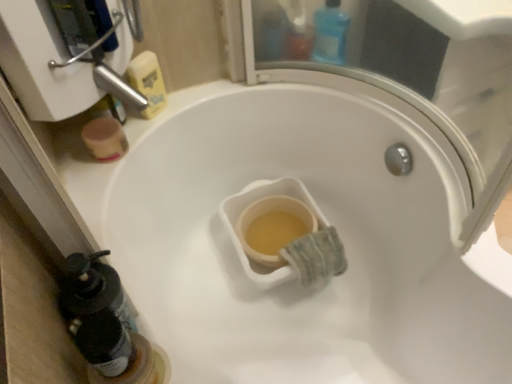
Find the location of a particular element. This screenshot has height=384, width=512. translucent plastic bottle at lower left, the 2th bottle viewed from the back is located at coordinates (x=97, y=313).

Based on the photo, from the image's perspective, which one is positioned lower, blue plastic bottle at upper center, the 1th bottle when ordered from top to bottom, or translucent plastic bottle at lower left, acting as the first bottle starting from the front?

translucent plastic bottle at lower left, acting as the first bottle starting from the front, from the image's perspective.

Locate an element on the screen. bottle on the left of blue plastic bottle at upper center, the 1th bottle when ordered from top to bottom is located at coordinates (97, 313).

How far apart are blue plastic bottle at upper center, positioned as the second bottle in left-to-right order, and translucent plastic bottle at lower left, which is the second bottle in right-to-left order?

blue plastic bottle at upper center, positioned as the second bottle in left-to-right order, is 32.36 inches away from translucent plastic bottle at lower left, which is the second bottle in right-to-left order.

From a real-world perspective, is blue plastic bottle at upper center, the 1th bottle when ordered from top to bottom, positioned above or below translucent plastic bottle at lower left, which is the second bottle in right-to-left order?

blue plastic bottle at upper center, the 1th bottle when ordered from top to bottom, is situated lower than translucent plastic bottle at lower left, which is the second bottle in right-to-left order, in the real world.

Is translucent plastic bottle at lower left, acting as the first bottle starting from the front, a part of yellow matte sponge at upper left?

Definitely not — translucent plastic bottle at lower left, acting as the first bottle starting from the front, is not inside yellow matte sponge at upper left.

Is yellow matte sponge at upper left aimed at translucent plastic bottle at lower left, the 2th bottle viewed from the back?

No, yellow matte sponge at upper left does not turn towards translucent plastic bottle at lower left, the 2th bottle viewed from the back.

Consider the image. Considering the sizes of objects yellow matte sponge at upper left and translucent plastic bottle at lower left, acting as the first bottle starting from the front, in the image provided, who is smaller, yellow matte sponge at upper left or translucent plastic bottle at lower left, acting as the first bottle starting from the front,?

translucent plastic bottle at lower left, acting as the first bottle starting from the front.

Does blue plastic bottle at upper center, which is the second bottle in bottom-to-top order, have a larger size compared to yellow matte sponge at upper left?

Yes.

Locate an element on the screen. The image size is (512, 384). cleaning product on the left of blue plastic bottle at upper center, which ranks as the 1th bottle in right-to-left order is located at coordinates (148, 82).

Is blue plastic bottle at upper center, the 1th bottle when ordered from top to bottom, positioned with its back to yellow matte sponge at upper left?

Yes, blue plastic bottle at upper center, the 1th bottle when ordered from top to bottom,'s orientation is away from yellow matte sponge at upper left.

In the scene shown: Which is more to the left, blue plastic bottle at upper center, the second bottle when ordered from front to back, or yellow matte sponge at upper left?

yellow matte sponge at upper left.

Which object is thinner, translucent plastic bottle at lower left, which is the first bottle from bottom to top, or blue plastic bottle at upper center, the 1th bottle when ordered from top to bottom?

translucent plastic bottle at lower left, which is the first bottle from bottom to top.

Is translucent plastic bottle at lower left, the 2th bottle viewed from the back, in front of or behind blue plastic bottle at upper center, the first bottle from the back, in the image?

Clearly, translucent plastic bottle at lower left, the 2th bottle viewed from the back, is in front of blue plastic bottle at upper center, the first bottle from the back.

From the image's perspective, which is below, translucent plastic bottle at lower left, acting as the 2th bottle starting from the top, or blue plastic bottle at upper center, the first bottle from the back?

translucent plastic bottle at lower left, acting as the 2th bottle starting from the top.

Is translucent plastic bottle at lower left, which is the second bottle in right-to-left order, not close to yellow matte sponge at upper left?

That's not correct — translucent plastic bottle at lower left, which is the second bottle in right-to-left order, is a little close to yellow matte sponge at upper left.

How distant is translucent plastic bottle at lower left, which is the second bottle in right-to-left order, from yellow matte sponge at upper left?

The distance of translucent plastic bottle at lower left, which is the second bottle in right-to-left order, from yellow matte sponge at upper left is 22.84 inches.

From their relative heights in the image, would you say translucent plastic bottle at lower left, acting as the first bottle starting from the front, is taller or shorter than yellow matte sponge at upper left?

Considering their sizes, translucent plastic bottle at lower left, acting as the first bottle starting from the front, has less height than yellow matte sponge at upper left.

Is translucent plastic bottle at lower left, the 2th bottle viewed from the back, turned away from yellow matte sponge at upper left?

No, yellow matte sponge at upper left is not at the back of translucent plastic bottle at lower left, the 2th bottle viewed from the back.

Can you tell me how much yellow matte sponge at upper left and blue plastic bottle at upper center, the 1th bottle when ordered from top to bottom, differ in facing direction?

The angular difference between yellow matte sponge at upper left and blue plastic bottle at upper center, the 1th bottle when ordered from top to bottom, is 29.4 degrees.

At what (x,y) coordinates should I click in order to perform the action: click on cleaning product below the blue plastic bottle at upper center, the 1th bottle when ordered from top to bottom (from a real-world perspective). Please return your answer as a coordinate pair (x, y). This screenshot has height=384, width=512. Looking at the image, I should click on 148,82.

Is point (157, 80) closer to viewer compared to point (333, 24)?

No, (157, 80) is further to viewer.

Is blue plastic bottle at upper center, the 1th bottle when ordered from top to bottom, surrounded by yellow matte sponge at upper left?

Actually, blue plastic bottle at upper center, the 1th bottle when ordered from top to bottom, is outside yellow matte sponge at upper left.

At what (x,y) coordinates should I click in order to perform the action: click on bottle that is above the blue plastic bottle at upper center, the 1th bottle when ordered from top to bottom (from a real-world perspective). Please return your answer as a coordinate pair (x, y). This screenshot has height=384, width=512. Looking at the image, I should click on (97, 313).

At what (x,y) coordinates should I click in order to perform the action: click on cleaning product above the translucent plastic bottle at lower left, acting as the 2th bottle starting from the top (from the image's perspective). Please return your answer as a coordinate pair (x, y). Image resolution: width=512 pixels, height=384 pixels. Looking at the image, I should click on (148, 82).

Which object lies further to the anchor point translucent plastic bottle at lower left, acting as the first bottle starting from the front, yellow matte sponge at upper left or blue plastic bottle at upper center, which ranks as the 1th bottle in right-to-left order?

blue plastic bottle at upper center, which ranks as the 1th bottle in right-to-left order, is positioned further to the anchor translucent plastic bottle at lower left, acting as the first bottle starting from the front.

Based on the photo, looking at the image, which one is located closer to yellow matte sponge at upper left, blue plastic bottle at upper center, the first bottle from the back, or translucent plastic bottle at lower left, acting as the 2th bottle starting from the top?

The object closer to yellow matte sponge at upper left is blue plastic bottle at upper center, the first bottle from the back.

In the scene shown: When comparing their distances from translucent plastic bottle at lower left, acting as the first bottle starting from the front, does blue plastic bottle at upper center, the first bottle from the back, or yellow matte sponge at upper left seem further?

blue plastic bottle at upper center, the first bottle from the back, is further to translucent plastic bottle at lower left, acting as the first bottle starting from the front.

Estimate the real-world distances between objects in this image. Which object is further from yellow matte sponge at upper left, translucent plastic bottle at lower left, which ranks as the first bottle in left-to-right order, or blue plastic bottle at upper center, the 1th bottle when ordered from top to bottom?

Based on the image, translucent plastic bottle at lower left, which ranks as the first bottle in left-to-right order, appears to be further to yellow matte sponge at upper left.

Looking at the image, which one is located further to blue plastic bottle at upper center, the first bottle from the back, translucent plastic bottle at lower left, which is the first bottle from bottom to top, or yellow matte sponge at upper left?

Among the two, translucent plastic bottle at lower left, which is the first bottle from bottom to top, is located further to blue plastic bottle at upper center, the first bottle from the back.

Considering their positions, is yellow matte sponge at upper left positioned further to blue plastic bottle at upper center, the 1th bottle when ordered from top to bottom, than translucent plastic bottle at lower left, acting as the 2th bottle starting from the top?

Among the two, translucent plastic bottle at lower left, acting as the 2th bottle starting from the top, is located further to blue plastic bottle at upper center, the 1th bottle when ordered from top to bottom.

Where is `cleaning product between blue plastic bottle at upper center, which ranks as the 1th bottle in right-to-left order, and translucent plastic bottle at lower left, the 2th bottle viewed from the back, from top to bottom`? The height and width of the screenshot is (384, 512). cleaning product between blue plastic bottle at upper center, which ranks as the 1th bottle in right-to-left order, and translucent plastic bottle at lower left, the 2th bottle viewed from the back, from top to bottom is located at coordinates (148, 82).